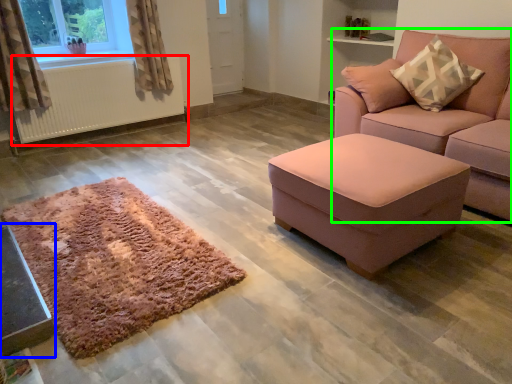
Question: Estimate the real-world distances between objects in this image. Which object is farther from radiator (highlighted by a red box), table (highlighted by a blue box) or studio couch (highlighted by a green box)?

Choices:
 (A) table
 (B) studio couch

Answer: (B)